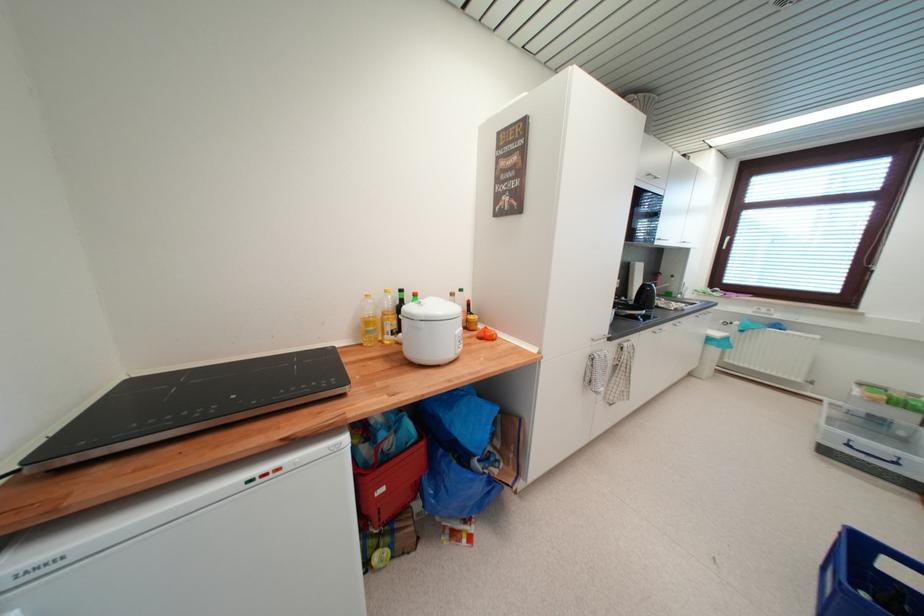
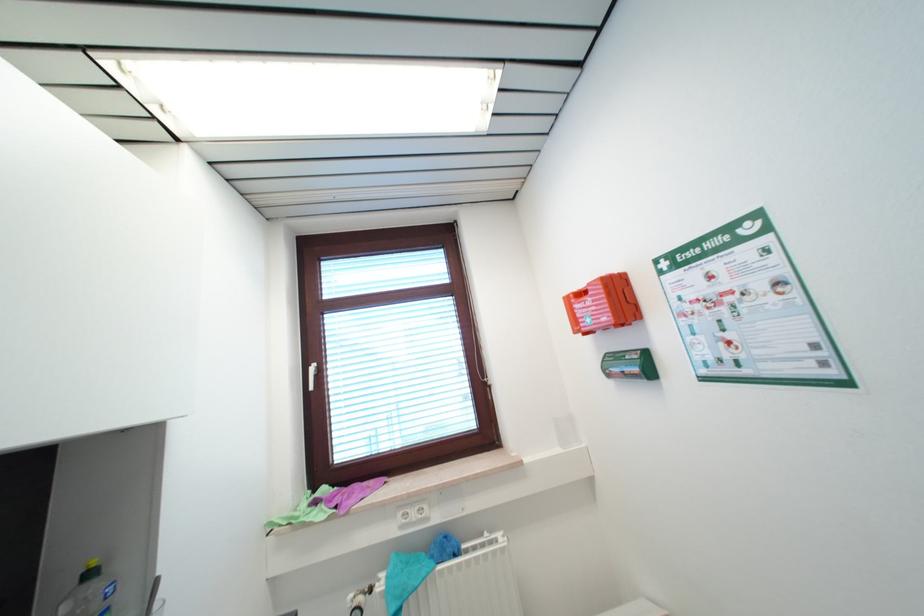
Where in the second image is the point corresponding to point 700,293 from the first image?

(274, 525)